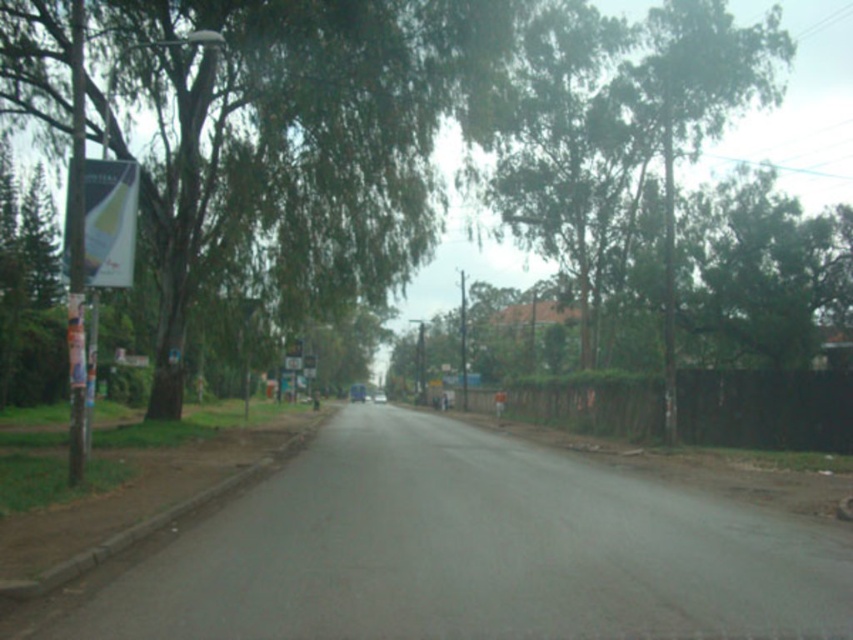
Question: Which point is farther from the camera taking this photo?

Choices:
 (A) (129, 205)
 (B) (357, 77)

Answer: (B)

Question: Does green leafy tree at left have a greater width compared to white glossy banner at left?

Choices:
 (A) yes
 (B) no

Answer: (A)

Question: From the image, what is the correct spatial relationship of green leafy tree at left in relation to white glossy banner at left?

Choices:
 (A) left
 (B) right

Answer: (B)

Question: Among these points, which one is nearest to the camera?

Choices:
 (A) (401, 49)
 (B) (103, 221)

Answer: (B)

Question: Does green leafy tree at left appear on the left side of white glossy banner at left?

Choices:
 (A) yes
 (B) no

Answer: (B)

Question: Which of the following is the closest to the observer?

Choices:
 (A) (173, 156)
 (B) (94, 243)

Answer: (B)